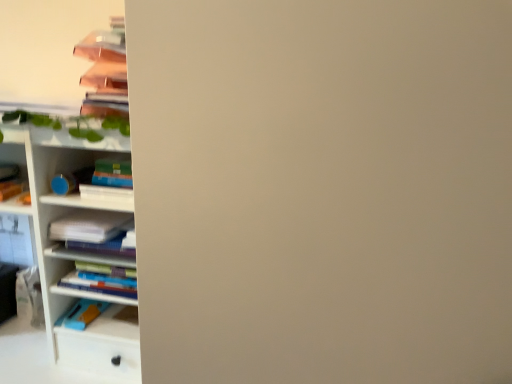
Question: Does white paper at left have a larger size compared to white glossy bookshelf at left?

Choices:
 (A) no
 (B) yes

Answer: (A)

Question: Is white paper at left located outside white glossy bookshelf at left?

Choices:
 (A) yes
 (B) no

Answer: (A)

Question: Are white paper at left and white glossy bookshelf at left beside each other?

Choices:
 (A) no
 (B) yes

Answer: (A)

Question: Is white paper at left positioned in front of white glossy bookshelf at left?

Choices:
 (A) yes
 (B) no

Answer: (B)

Question: Is white paper at left to the left of white glossy bookshelf at left from the viewer's perspective?

Choices:
 (A) no
 (B) yes

Answer: (A)

Question: Does white paper at left have a greater width compared to white glossy bookshelf at left?

Choices:
 (A) yes
 (B) no

Answer: (A)

Question: Can you confirm if white glossy bookshelf at left is wider than white paper at left?

Choices:
 (A) no
 (B) yes

Answer: (A)

Question: Is white glossy bookshelf at left bigger than white paper at left?

Choices:
 (A) no
 (B) yes

Answer: (B)

Question: Can you confirm if white glossy bookshelf at left is taller than white paper at left?

Choices:
 (A) yes
 (B) no

Answer: (A)

Question: From a real-world perspective, is white glossy bookshelf at left positioned under white paper at left based on gravity?

Choices:
 (A) no
 (B) yes

Answer: (A)

Question: Can you confirm if white glossy bookshelf at left is shorter than white paper at left?

Choices:
 (A) yes
 (B) no

Answer: (B)

Question: Does white glossy bookshelf at left have a lesser width compared to white paper at left?

Choices:
 (A) no
 (B) yes

Answer: (B)

Question: Is white paper at left inside or outside of white glossy bookshelf at left?

Choices:
 (A) outside
 (B) inside

Answer: (A)